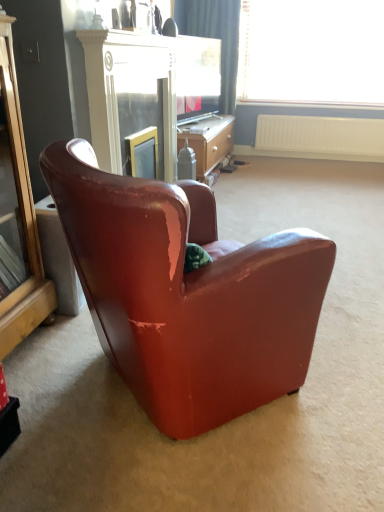
Question: Is wooden desk at center oriented away from gold mirrored cabinet at left?

Choices:
 (A) no
 (B) yes

Answer: (A)

Question: From a real-world perspective, is wooden desk at center located higher than gold mirrored cabinet at left?

Choices:
 (A) no
 (B) yes

Answer: (A)

Question: From the image's perspective, is wooden desk at center beneath gold mirrored cabinet at left?

Choices:
 (A) no
 (B) yes

Answer: (A)

Question: Is wooden desk at center oriented towards gold mirrored cabinet at left?

Choices:
 (A) no
 (B) yes

Answer: (A)

Question: Considering the relative sizes of wooden desk at center and gold mirrored cabinet at left in the image provided, is wooden desk at center taller than gold mirrored cabinet at left?

Choices:
 (A) no
 (B) yes

Answer: (A)

Question: Considering the positions of point (210, 57) and point (157, 211), is point (210, 57) closer or farther from the camera than point (157, 211)?

Choices:
 (A) closer
 (B) farther

Answer: (B)

Question: Considering their positions, is matte black television at center located in front of or behind leather armchair at center?

Choices:
 (A) behind
 (B) front

Answer: (A)

Question: From the image's perspective, is matte black television at center positioned above or below leather armchair at center?

Choices:
 (A) below
 (B) above

Answer: (B)

Question: In terms of size, does matte black television at center appear bigger or smaller than leather armchair at center?

Choices:
 (A) big
 (B) small

Answer: (B)

Question: In terms of height, does gold mirrored cabinet at left look taller or shorter compared to leather armchair at center?

Choices:
 (A) short
 (B) tall

Answer: (B)

Question: Is gold mirrored cabinet at left in front of or behind leather armchair at center in the image?

Choices:
 (A) behind
 (B) front

Answer: (A)

Question: Is gold mirrored cabinet at left wider or thinner than leather armchair at center?

Choices:
 (A) wide
 (B) thin

Answer: (B)

Question: Would you say gold mirrored cabinet at left is to the left or to the right of leather armchair at center in the picture?

Choices:
 (A) left
 (B) right

Answer: (A)

Question: Choose the correct answer: Is gold mirrored cabinet at left inside white plastic radiator at upper right or outside it?

Choices:
 (A) outside
 (B) inside

Answer: (A)

Question: From the image's perspective, is gold mirrored cabinet at left located above or below white plastic radiator at upper right?

Choices:
 (A) below
 (B) above

Answer: (A)